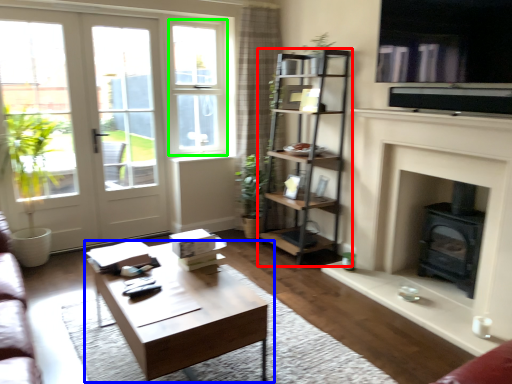
Question: Which is nearer to the shelf (highlighted by a red box)? coffee table (highlighted by a blue box) or window frame (highlighted by a green box).

Choices:
 (A) coffee table
 (B) window frame

Answer: (B)